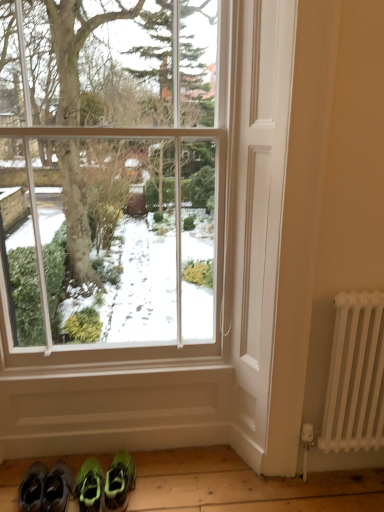
Question: From a real-world perspective, is clear glass window at center physically below green suede sneakers at lower left, the third footwear viewed from the right?

Choices:
 (A) yes
 (B) no

Answer: (B)

Question: Would you consider clear glass window at center to be distant from green suede sneakers at lower left, the third footwear viewed from the right?

Choices:
 (A) no
 (B) yes

Answer: (B)

Question: Is clear glass window at center positioned with its back to green suede sneakers at lower left, which is the first footwear from left to right?

Choices:
 (A) no
 (B) yes

Answer: (B)

Question: From the image's perspective, is clear glass window at center on top of green suede sneakers at lower left, which is the first footwear from left to right?

Choices:
 (A) yes
 (B) no

Answer: (A)

Question: Considering the relative sizes of clear glass window at center and green suede sneakers at lower left, the third footwear viewed from the right, in the image provided, is clear glass window at center wider than green suede sneakers at lower left, the third footwear viewed from the right,?

Choices:
 (A) no
 (B) yes

Answer: (A)

Question: Can you see clear glass window at center touching green suede sneakers at lower left, which is the first footwear from left to right?

Choices:
 (A) yes
 (B) no

Answer: (B)

Question: Is white metal radiator at right facing away from clear glass window at center?

Choices:
 (A) no
 (B) yes

Answer: (A)

Question: Can you confirm if white metal radiator at right is smaller than clear glass window at center?

Choices:
 (A) yes
 (B) no

Answer: (A)

Question: Is white metal radiator at right far away from clear glass window at center?

Choices:
 (A) no
 (B) yes

Answer: (A)

Question: Is the depth of white metal radiator at right less than that of clear glass window at center?

Choices:
 (A) no
 (B) yes

Answer: (A)

Question: Can you confirm if white metal radiator at right is positioned to the right of clear glass window at center?

Choices:
 (A) no
 (B) yes

Answer: (B)

Question: Can you confirm if white metal radiator at right is taller than clear glass window at center?

Choices:
 (A) no
 (B) yes

Answer: (A)

Question: Is green suede sneakers at lower left, the second footwear in the right-to-left sequence, to the left of clear glass window at center from the viewer's perspective?

Choices:
 (A) no
 (B) yes

Answer: (B)